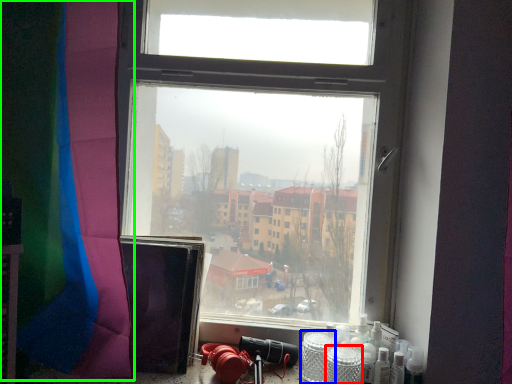
Question: Which object is the farthest from glass jar (highlighted by a red box)? Choose among these: glass jar (highlighted by a blue box) or curtain (highlighted by a green box).

Choices:
 (A) glass jar
 (B) curtain

Answer: (B)